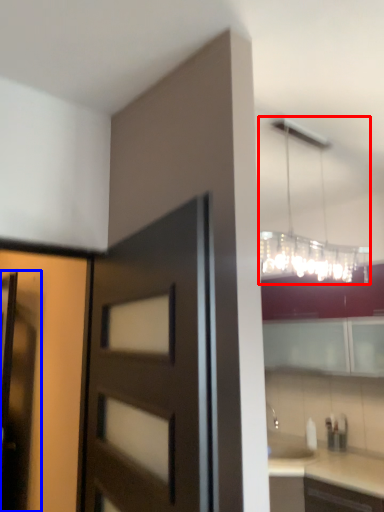
Question: Which point is further to the camera, lamp (highlighted by a red box) or screen door (highlighted by a blue box)?

Choices:
 (A) lamp
 (B) screen door

Answer: (B)